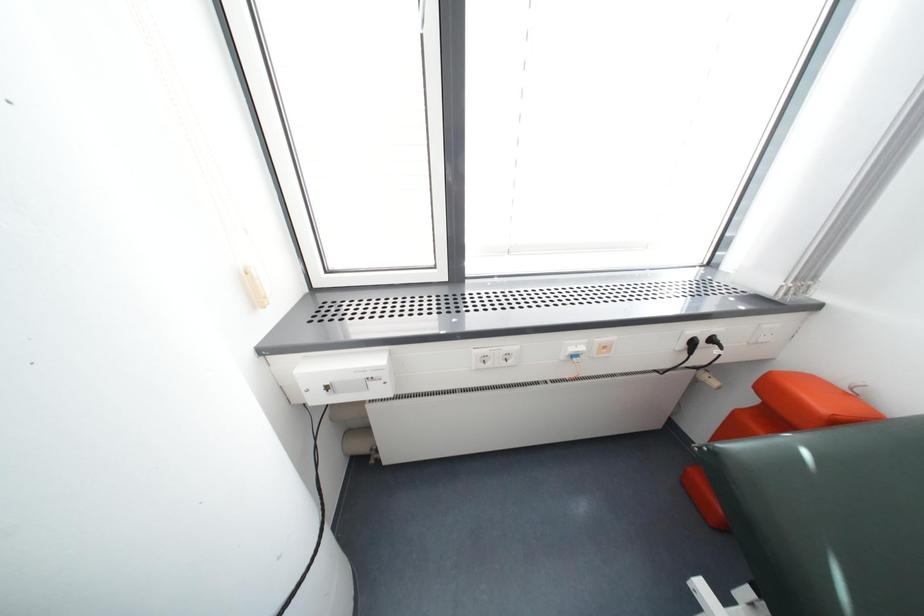
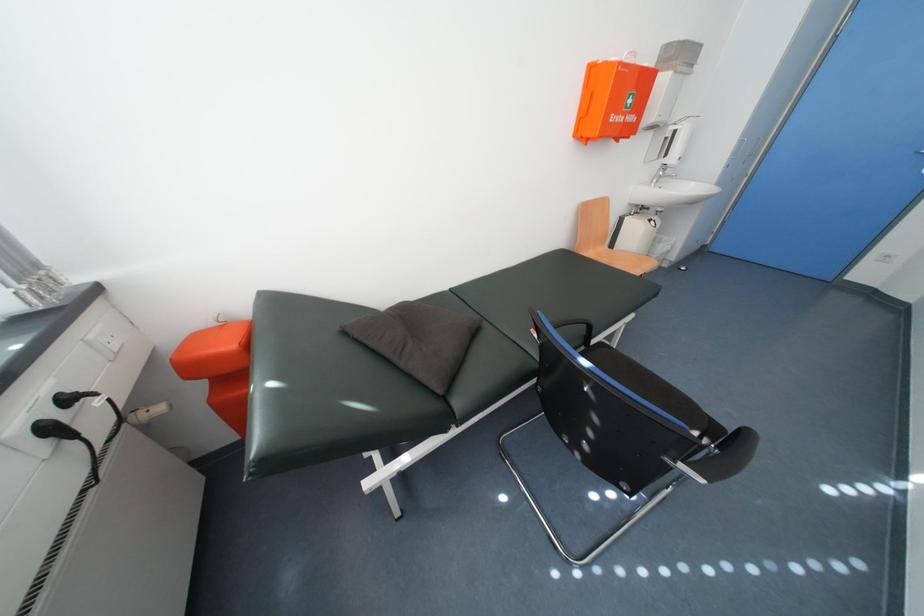
The first image is from the beginning of the video and the second image is from the end. How did the camera likely rotate when shooting the video?

The camera rotated toward right-down.